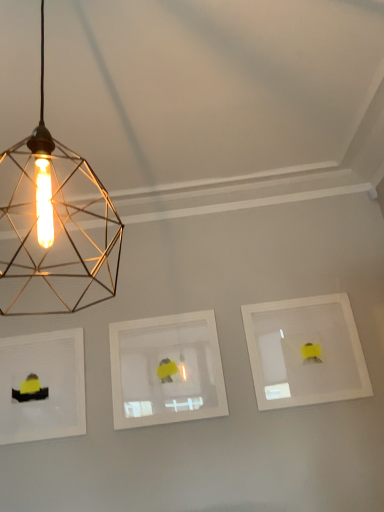
Question: Is gold wire mesh light bulb at upper left positioned with its back to matte white picture frame at left, which ranks as the 3th picture frame in right-to-left order?

Choices:
 (A) yes
 (B) no

Answer: (B)

Question: From a real-world perspective, is gold wire mesh light bulb at upper left on top of matte white picture frame at left, positioned as the 1th picture frame in left-to-right order?

Choices:
 (A) yes
 (B) no

Answer: (A)

Question: Is gold wire mesh light bulb at upper left thinner than matte white picture frame at left, which ranks as the 3th picture frame in right-to-left order?

Choices:
 (A) no
 (B) yes

Answer: (A)

Question: From the image's perspective, is gold wire mesh light bulb at upper left under matte white picture frame at left, positioned as the 1th picture frame in left-to-right order?

Choices:
 (A) yes
 (B) no

Answer: (B)

Question: Can you confirm if gold wire mesh light bulb at upper left is shorter than matte white picture frame at left, positioned as the 1th picture frame in left-to-right order?

Choices:
 (A) yes
 (B) no

Answer: (B)

Question: From the image's perspective, relative to white matte picture frame at right, acting as the first picture frame starting from the right, is matte white picture frame at left, positioned as the 1th picture frame in left-to-right order, above or below?

Choices:
 (A) below
 (B) above

Answer: (A)

Question: Would you say matte white picture frame at left, which ranks as the 3th picture frame in right-to-left order, is inside or outside white matte picture frame at right, acting as the first picture frame starting from the right?

Choices:
 (A) outside
 (B) inside

Answer: (A)

Question: From their relative heights in the image, would you say matte white picture frame at left, positioned as the 1th picture frame in left-to-right order, is taller or shorter than white matte picture frame at right, acting as the first picture frame starting from the right?

Choices:
 (A) tall
 (B) short

Answer: (B)

Question: In terms of width, does matte white picture frame at left, which ranks as the 3th picture frame in right-to-left order, look wider or thinner when compared to white matte picture frame at right, positioned as the 3th picture frame in left-to-right order?

Choices:
 (A) thin
 (B) wide

Answer: (B)

Question: Does point (34, 305) appear closer or farther from the camera than point (253, 338)?

Choices:
 (A) closer
 (B) farther

Answer: (B)

Question: Is gold wire mesh light bulb at upper left taller or shorter than white matte picture frame at right, positioned as the 3th picture frame in left-to-right order?

Choices:
 (A) short
 (B) tall

Answer: (B)

Question: Looking at the image, does gold wire mesh light bulb at upper left seem bigger or smaller compared to white matte picture frame at right, acting as the first picture frame starting from the right?

Choices:
 (A) small
 (B) big

Answer: (B)

Question: From a real-world perspective, is gold wire mesh light bulb at upper left positioned above or below white matte picture frame at right, positioned as the 3th picture frame in left-to-right order?

Choices:
 (A) below
 (B) above

Answer: (B)

Question: In terms of height, does gold wire mesh light bulb at upper left look taller or shorter compared to matte white picture frame at left, positioned as the 1th picture frame in left-to-right order?

Choices:
 (A) tall
 (B) short

Answer: (A)

Question: Looking at the image, does gold wire mesh light bulb at upper left seem bigger or smaller compared to matte white picture frame at left, which ranks as the 3th picture frame in right-to-left order?

Choices:
 (A) big
 (B) small

Answer: (A)